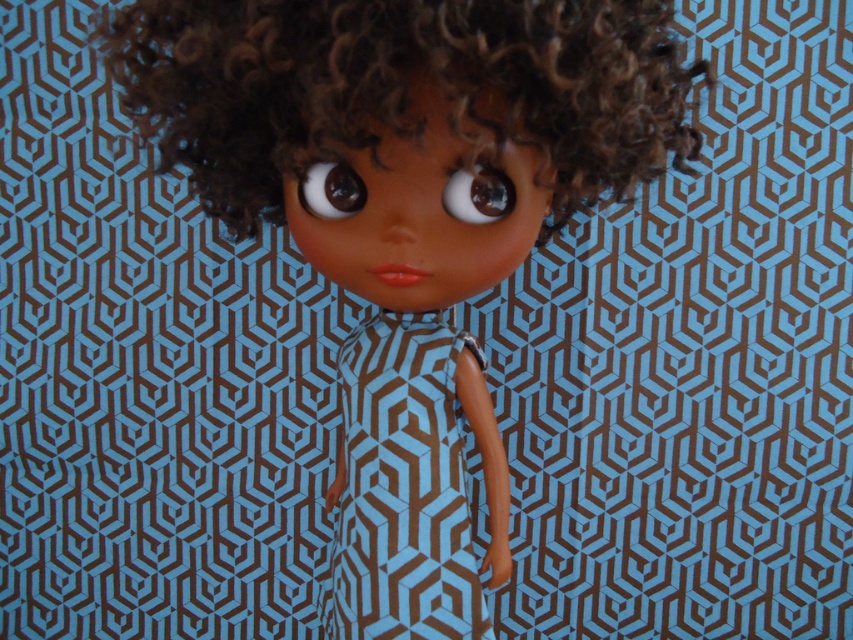
You are a toy designer trying to create a storage box for the matte plastic doll at center and its brown curly hair at center. Based on their sizes, which object requires a larger compartment in the box?

The brown curly hair at center requires a larger compartment because the matte plastic doll at center is narrower than the brown curly hair at center.

You are a photographer trying to capture the doll from the front. You notice two points marked on the image at coordinates point (396, 112) and point (474, 346). Which point should you focus on to ensure the doll is in focus?

You should focus on point (396, 112) because it is in front of point (474, 346), making it closer to the camera and thus in focus.